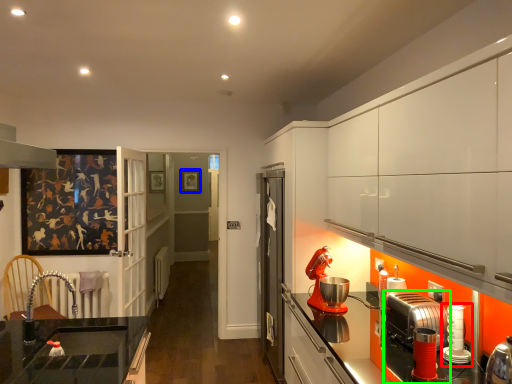
Question: Which object is the farthest from kitchen appliance (highlighted by a red box)? Choose among these: picture frame (highlighted by a blue box) or kitchen appliance (highlighted by a green box).

Choices:
 (A) picture frame
 (B) kitchen appliance

Answer: (A)